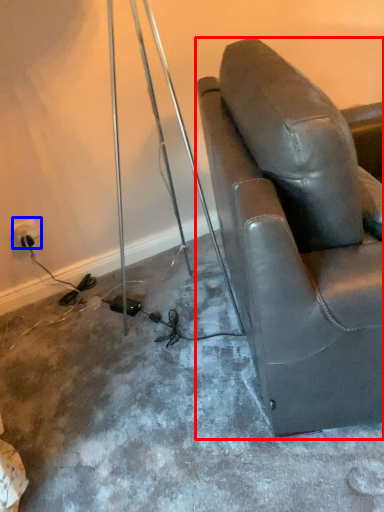
Question: Among these objects, which one is nearest to the camera, chair (highlighted by a red box) or electric outlet (highlighted by a blue box)?

Choices:
 (A) chair
 (B) electric outlet

Answer: (A)